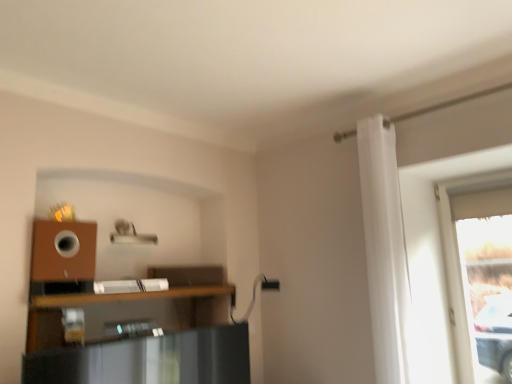
Question: Does transparent glass window at right have a greater height compared to brown wooden shelf at lower left?

Choices:
 (A) no
 (B) yes

Answer: (B)

Question: Considering the relative sizes of transparent glass window at right and brown wooden shelf at lower left in the image provided, is transparent glass window at right bigger than brown wooden shelf at lower left?

Choices:
 (A) no
 (B) yes

Answer: (B)

Question: From the image's perspective, is transparent glass window at right on brown wooden shelf at lower left?

Choices:
 (A) no
 (B) yes

Answer: (B)

Question: Considering the relative sizes of transparent glass window at right and brown wooden shelf at lower left in the image provided, is transparent glass window at right thinner than brown wooden shelf at lower left?

Choices:
 (A) yes
 (B) no

Answer: (A)

Question: Does transparent glass window at right have a lesser height compared to brown wooden shelf at lower left?

Choices:
 (A) no
 (B) yes

Answer: (A)

Question: Does transparent glass window at right appear on the left side of brown wooden shelf at lower left?

Choices:
 (A) no
 (B) yes

Answer: (A)

Question: Is white fabric curtain at right thinner than transparent glass window at right?

Choices:
 (A) yes
 (B) no

Answer: (B)

Question: From a real-world perspective, is white fabric curtain at right physically above transparent glass window at right?

Choices:
 (A) yes
 (B) no

Answer: (A)

Question: Can you confirm if white fabric curtain at right is positioned to the right of transparent glass window at right?

Choices:
 (A) no
 (B) yes

Answer: (A)

Question: Is white fabric curtain at right in front of transparent glass window at right?

Choices:
 (A) yes
 (B) no

Answer: (A)

Question: Is white fabric curtain at right located outside transparent glass window at right?

Choices:
 (A) no
 (B) yes

Answer: (B)

Question: Can you confirm if white fabric curtain at right is smaller than transparent glass window at right?

Choices:
 (A) yes
 (B) no

Answer: (B)

Question: Is transparent glass window at right turned away from white fabric curtain at right?

Choices:
 (A) no
 (B) yes

Answer: (A)